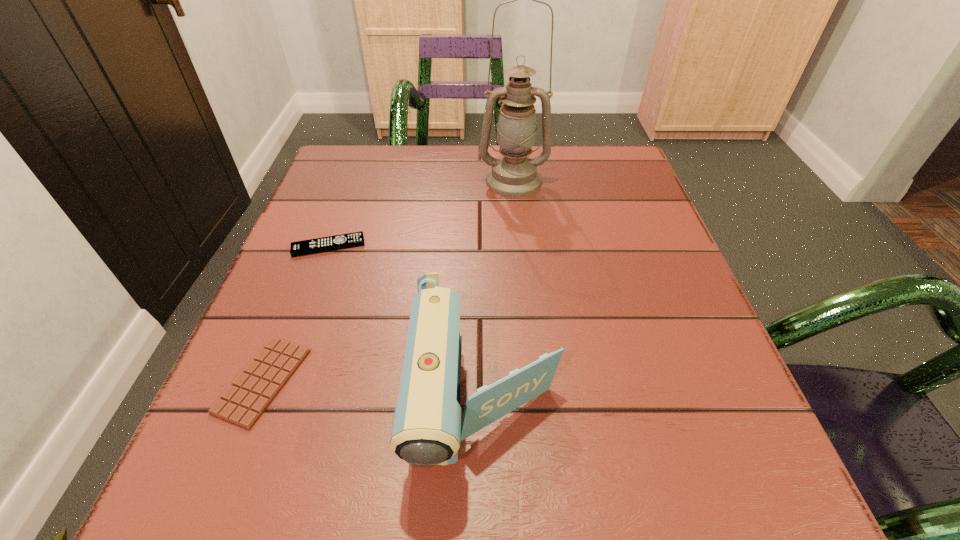
Where is `the farthest object`? the farthest object is located at coordinates (514, 173).

Identify the location of oil lamp. (514, 173).

At what (x,y) coordinates should I click in order to perform the action: click on the third shortest object. Please return your answer as a coordinate pair (x, y). This screenshot has height=540, width=960. Looking at the image, I should click on (427, 429).

At what (x,y) coordinates should I click in order to perform the action: click on the second shortest object. Please return your answer as a coordinate pair (x, y). Looking at the image, I should click on (331, 243).

Locate an element on the screen. The image size is (960, 540). remote control is located at coordinates (331, 243).

What are the coordinates of `the shortest object` in the screenshot? It's located at (243, 403).

Where is `vacant space situated 0.050m on the back of the tallest object`? This screenshot has height=540, width=960. vacant space situated 0.050m on the back of the tallest object is located at coordinates (511, 156).

This screenshot has width=960, height=540. Identify the location of vacant space located 0.350m on the right of the third tallest object. (539, 246).

Find the location of a particular element. This screenshot has width=960, height=540. blank space located on the right of the candy bar is located at coordinates (341, 381).

Locate an element on the screen. object at the far edge is located at coordinates (514, 173).